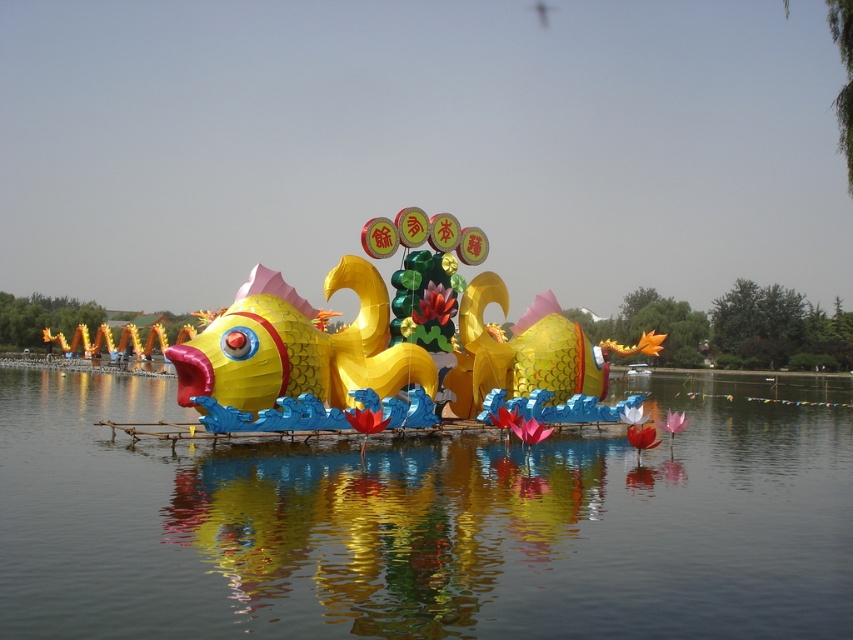
Question: Which point appears farthest from the camera in this image?

Choices:
 (A) (367, 268)
 (B) (816, 500)

Answer: (A)

Question: Is glossy water at center further to the viewer compared to shiny gold fish at center?

Choices:
 (A) yes
 (B) no

Answer: (B)

Question: Does glossy water at center have a larger size compared to shiny gold fish at center?

Choices:
 (A) no
 (B) yes

Answer: (B)

Question: Can you confirm if glossy water at center is positioned to the right of shiny gold fish at center?

Choices:
 (A) no
 (B) yes

Answer: (B)